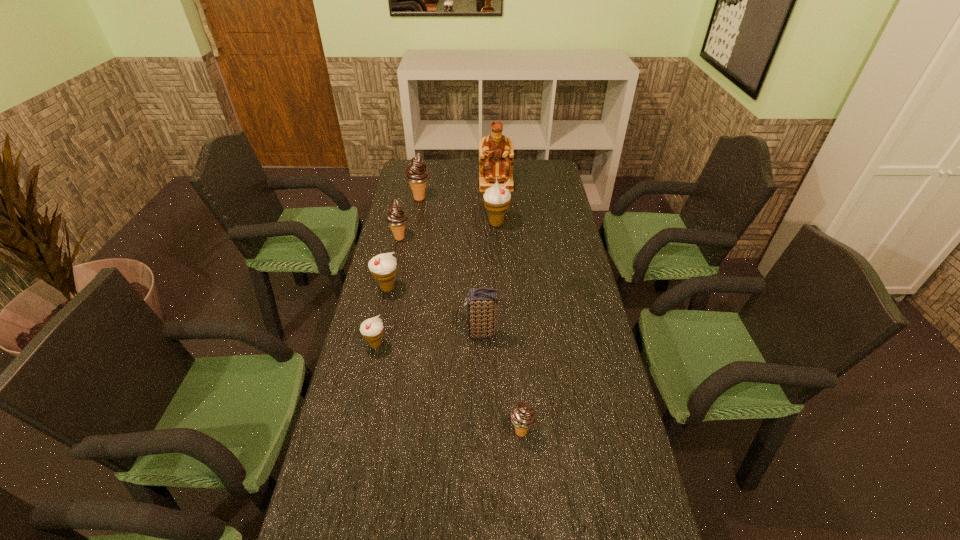
Where is `the smallest white icecream`? The height and width of the screenshot is (540, 960). the smallest white icecream is located at coordinates (372, 329).

The width and height of the screenshot is (960, 540). I want to click on the nearest icecream, so click(x=522, y=416).

Where is `the rightmost chocolate icecream`? The image size is (960, 540). the rightmost chocolate icecream is located at coordinates (522, 416).

This screenshot has height=540, width=960. In order to click on vacant position located on the front-facing side of the figurine in this screenshot , I will do `click(498, 220)`.

Locate an element on the screen. This screenshot has height=540, width=960. vacant space located 0.270m on the left of the farthest white icecream is located at coordinates (415, 224).

I want to click on vacant space located 0.150m on the front of the farthest icecream, so click(x=415, y=225).

Locate an element on the screen. This screenshot has height=540, width=960. vacant space located 0.180m with the zip open on the clutch bag is located at coordinates (406, 334).

The image size is (960, 540). Identify the location of vacant area situated with the zip open on the clutch bag. (370, 334).

You are a GUI agent. You are given a task and a screenshot of the screen. Output one action in this format:
    pyautogui.click(x=<x>, y=<y>)
    Task: Click on the free spot located with the zip open on the clutch bag
    Image resolution: width=960 pixels, height=540 pixels.
    Given the screenshot: What is the action you would take?
    pyautogui.click(x=370, y=334)

You are a GUI agent. You are given a task and a screenshot of the screen. Output one action in this format:
    pyautogui.click(x=<x>, y=<y>)
    Task: Click on the vacant position located on the back of the second smallest chocolate icecream
    This screenshot has height=540, width=960.
    Given the screenshot: What is the action you would take?
    pyautogui.click(x=410, y=192)